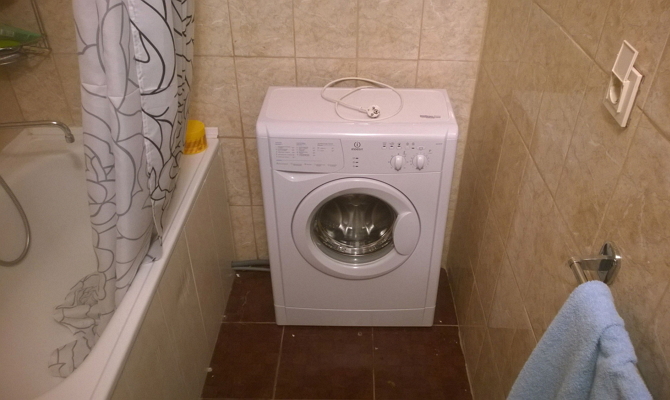
At what (x,y) coordinates should I click in order to perform the action: click on blue towel. Please return your answer as a coordinate pair (x, y). This screenshot has height=400, width=670. Looking at the image, I should click on (602, 318).